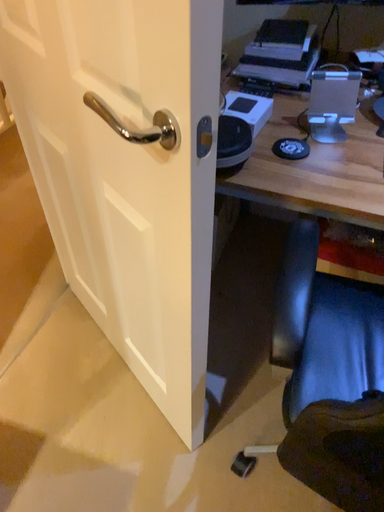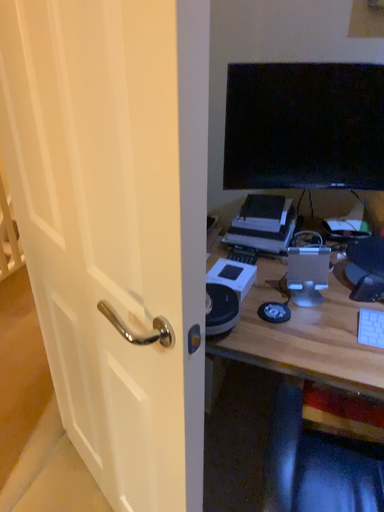
Question: Which way did the camera rotate in the video?

Choices:
 (A) rotated upward
 (B) rotated downward

Answer: (A)